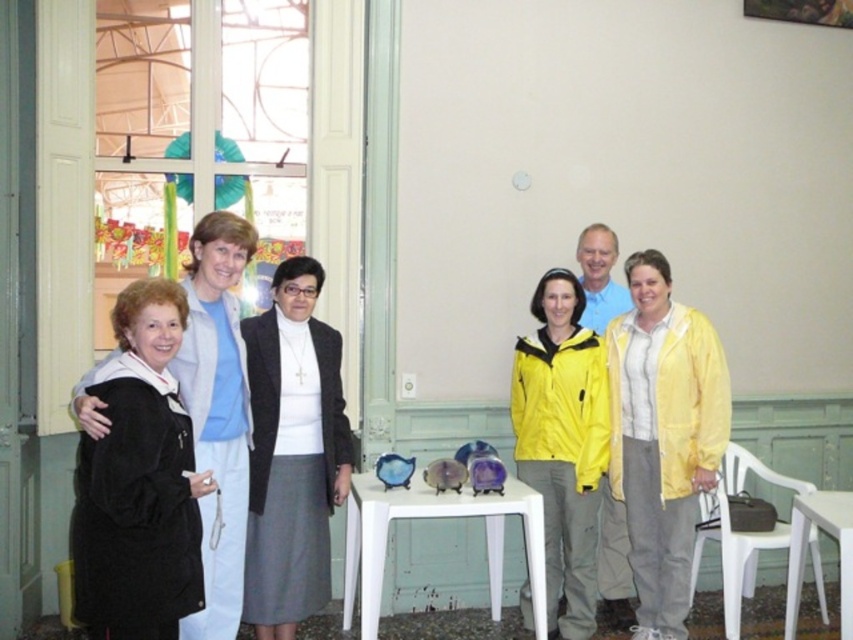
You are a photographer trying to adjust the lighting for a group photo. You notice two items on the left side of the image that might be casting shadows. Which item is closer to the camera between the black matte jacket at left and the black velvet coat at left?

The black matte jacket at left is closer to the camera because the black velvet coat at left is behind it.

You are organizing a photo shoot and need to determine which jacket to use for a closeup shot. The photographer prefers a larger jacket for better visibility. Which jacket between the black matte jacket at left and the yellow matte jacket at center should you choose?

The black matte jacket at left is bigger than the yellow matte jacket at center, so you should choose the black matte jacket at left for the closeup shot to ensure better visibility.

You are a photographer setting up for a group photo. You notice two black coats in the scene. The black matte jacket at left and the black velvet coat at left. Which one should you adjust to avoid blocking the light coming from the window on the left? Explain your reasoning.

The black velvet coat at left should be adjusted because it is positioned to the left of the black matte jacket at left. Since the window is on the left side of the image, the velvet coat is closer to the light source and might cast a shadow or block some light, so moving it would help optimize lighting for the photo.